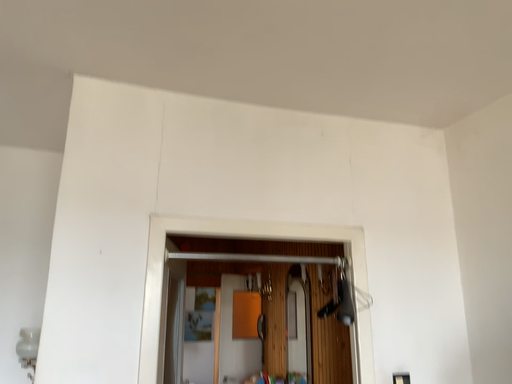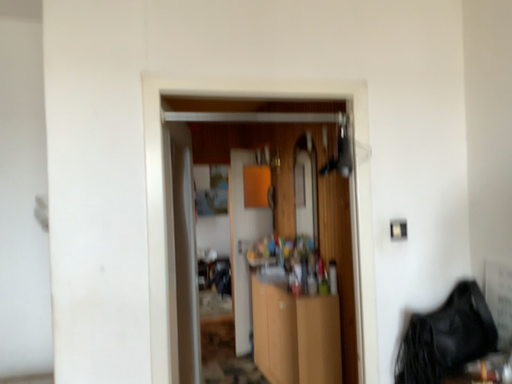
Question: Which way did the camera rotate in the video?

Choices:
 (A) rotated upward
 (B) rotated downward

Answer: (B)